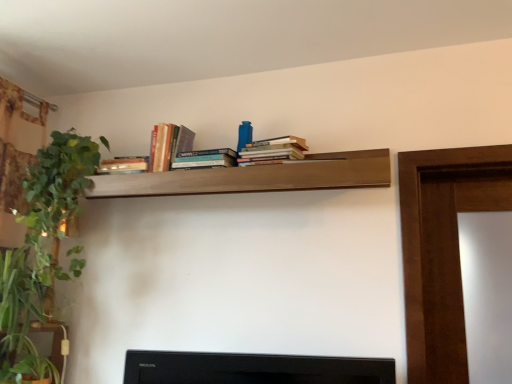
Question: Considering the positions of point (36, 286) and point (164, 168), is point (36, 286) closer or farther from the camera than point (164, 168)?

Choices:
 (A) closer
 (B) farther

Answer: (B)

Question: Looking at their shapes, would you say green leafy plant at left is wider or thinner than hardcover books at upper center, arranged as the 3th book when viewed from the right?

Choices:
 (A) thin
 (B) wide

Answer: (B)

Question: Based on their relative distances, which object is nearer to the hardcover books at center, acting as the first book starting from the right?

Choices:
 (A) green leafy plant at left
 (B) hardcover books at upper center, the first book viewed from the left
 (C) green leafy plant at left
 (D) green leafy plant at left
 (E) hardcover books at center, the 2th book viewed from the left

Answer: (E)

Question: Which object is positioned closest to the green leafy plant at left?

Choices:
 (A) wooden shelf at upper center
 (B) green leafy plant at left
 (C) hardcover books at center, the 2th book viewed from the left
 (D) green leafy plant at left
 (E) hardcover books at upper center, the first book viewed from the left

Answer: (D)